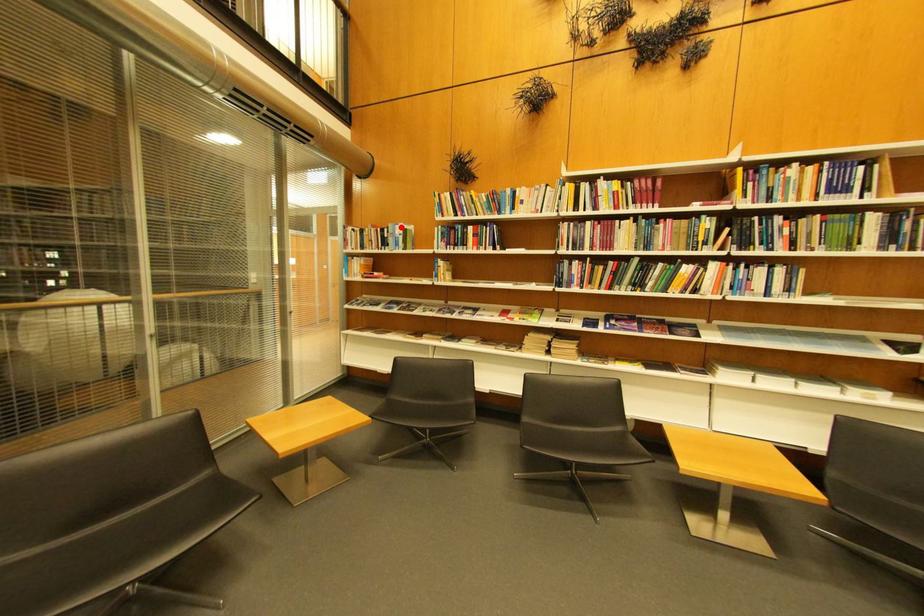
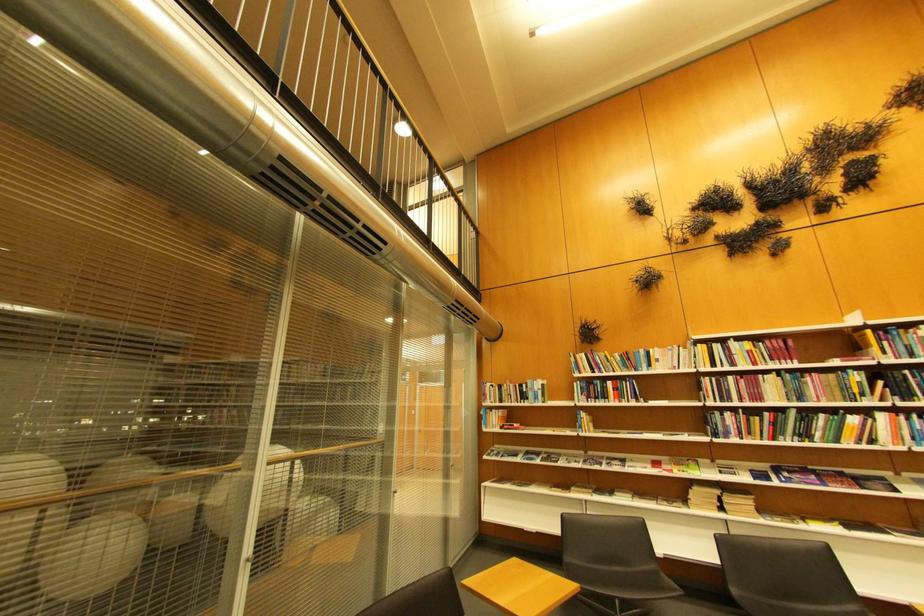
Find the pixel in the second image that matches the highlighted location in the first image.

(540, 383)